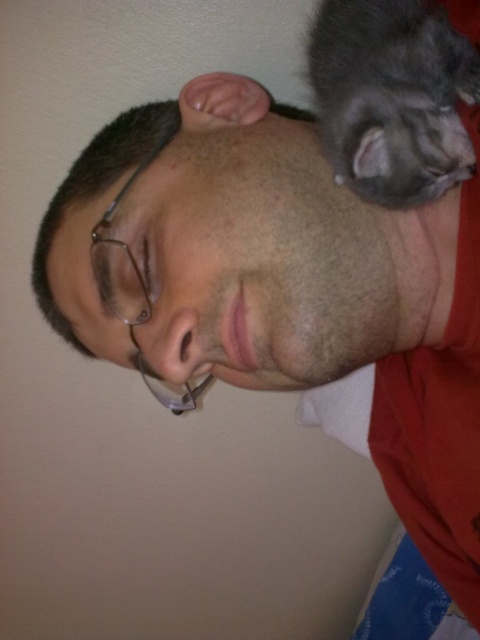
Between matte black hair at upper center and gray fluffy cat at upper right, which one appears on the left side from the viewer's perspective?

matte black hair at upper center is more to the left.

Who is shorter, matte black hair at upper center or gray fluffy cat at upper right?

gray fluffy cat at upper right

Is point (317, 228) more distant than point (462, 51)?

Yes, it is.

You are a GUI agent. You are given a task and a screenshot of the screen. Output one action in this format:
    pyautogui.click(x=<x>, y=<y>)
    Task: Click on the matte black hair at upper center
    
    Given the screenshot: What is the action you would take?
    pyautogui.click(x=231, y=253)